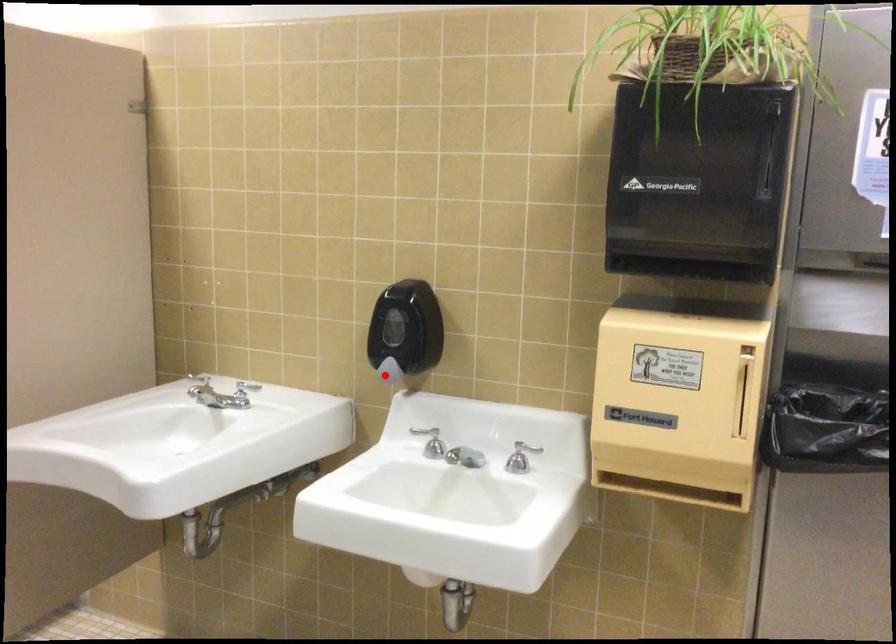
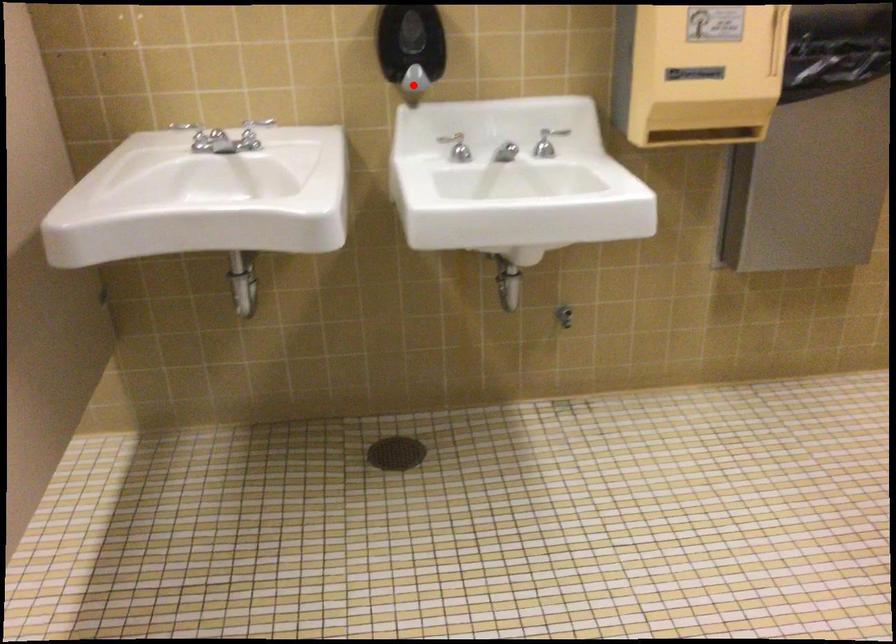
I am providing you with two images of the same scene from different viewpoints. A red point is marked on the first image and another point is marked on the second image. Are the points marked in image1 and image2 representing the same 3D position?

Yes